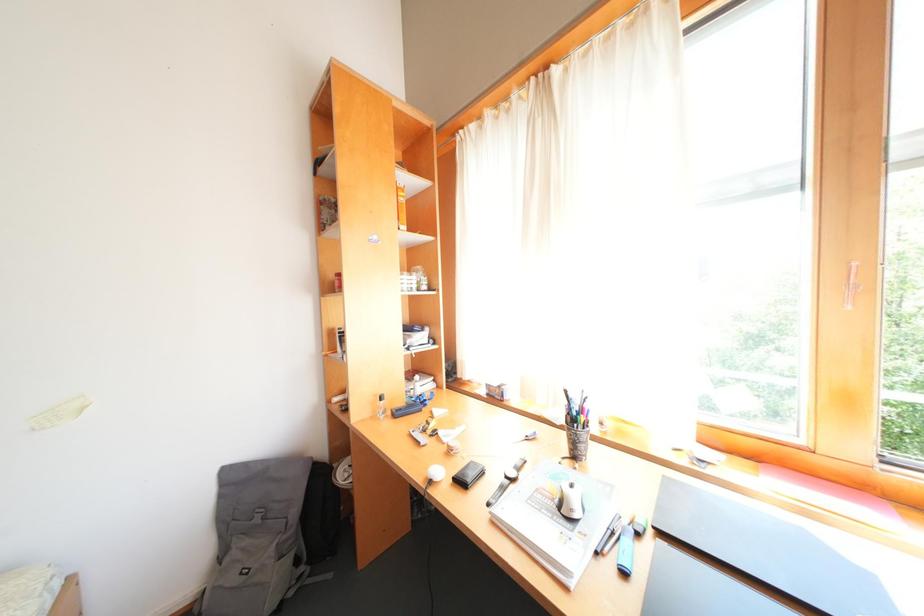
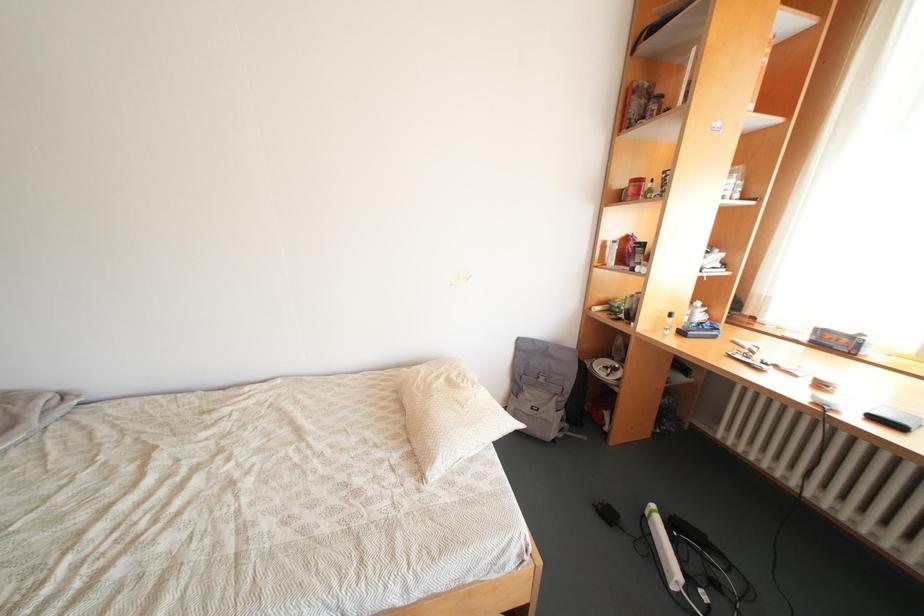
The images are taken continuously from a first-person perspective. In which direction is your viewpoint rotating?

The camera rotated toward left-down.